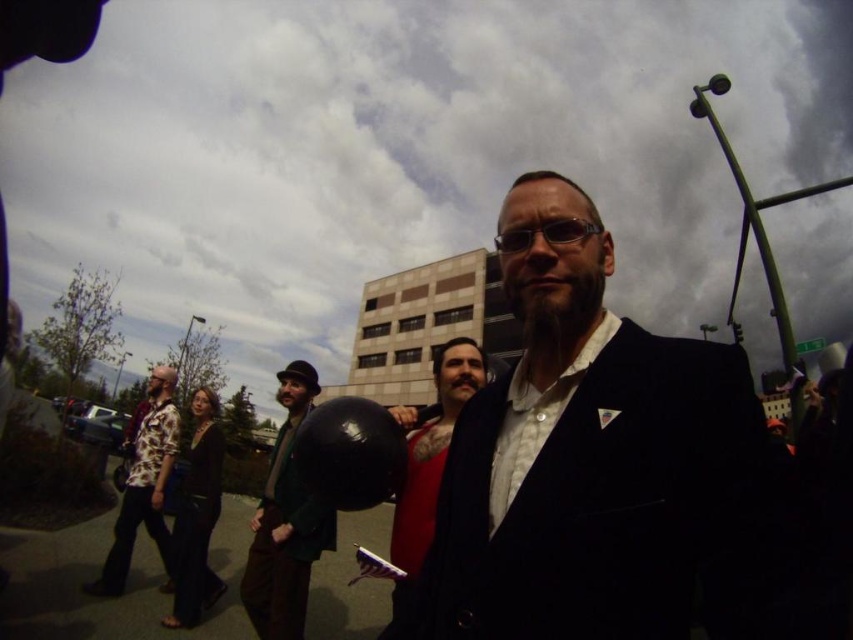
Question: Is green wool coat at center closer to camera compared to red velvet coat at center?

Choices:
 (A) yes
 (B) no

Answer: (B)

Question: Which is farther from the velvet black suit at center?

Choices:
 (A) green wool coat at center
 (B) red velvet coat at center
 (C) printed cotton shirt at left

Answer: (C)

Question: Can you confirm if velvet black suit at center is bigger than green wool coat at center?

Choices:
 (A) no
 (B) yes

Answer: (A)

Question: Observing the image, what is the correct spatial positioning of velvet black suit at center in reference to green wool coat at center?

Choices:
 (A) right
 (B) left

Answer: (A)

Question: Among these objects, which one is nearest to the camera?

Choices:
 (A) printed cotton shirt at left
 (B) red velvet coat at center

Answer: (B)

Question: Which object is positioned closest to the printed cotton shirt at left?

Choices:
 (A) red velvet coat at center
 (B) velvet black suit at center
 (C) green wool coat at center

Answer: (C)